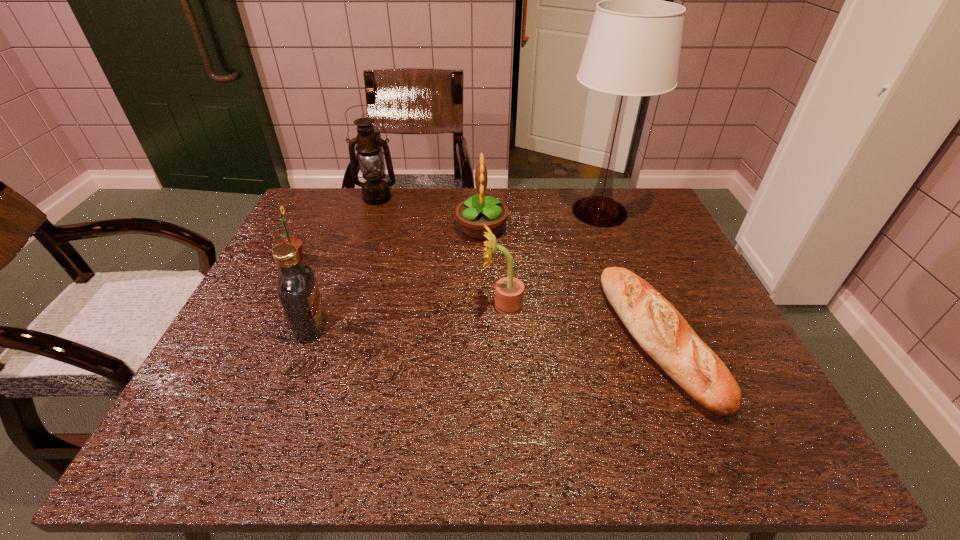
Identify the location of object at the near right corner. (662, 332).

In the image, there is a desktop. Where is `vacant space at the far edge`? vacant space at the far edge is located at coordinates [589, 227].

In the image, there is a desktop. Where is `vacant space at the left edge`? vacant space at the left edge is located at coordinates (266, 373).

Locate an element on the screen. vacant area at the right edge is located at coordinates (674, 274).

The image size is (960, 540). In the image, there is a desktop. Find the location of `blank space at the far left corner`. blank space at the far left corner is located at coordinates (291, 231).

In the image, there is a desktop. Where is `vacant area at the far right corner`? Image resolution: width=960 pixels, height=540 pixels. vacant area at the far right corner is located at coordinates (623, 200).

Locate an element on the screen. This screenshot has height=540, width=960. vacant area at the near right corner is located at coordinates (762, 425).

Where is `free space between the nearest sunflower and the leftmost object`? The height and width of the screenshot is (540, 960). free space between the nearest sunflower and the leftmost object is located at coordinates (399, 282).

Locate an element on the screen. This screenshot has width=960, height=540. vacant space that is in between the vodka and the nearest sunflower is located at coordinates (407, 316).

Image resolution: width=960 pixels, height=540 pixels. I want to click on vacant space in between the nearest sunflower and the tallest object, so click(551, 259).